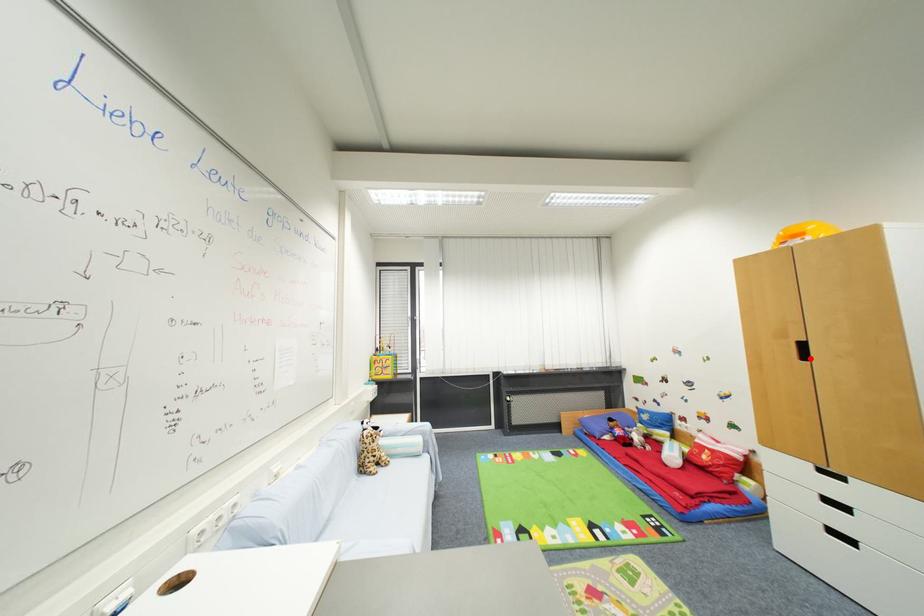
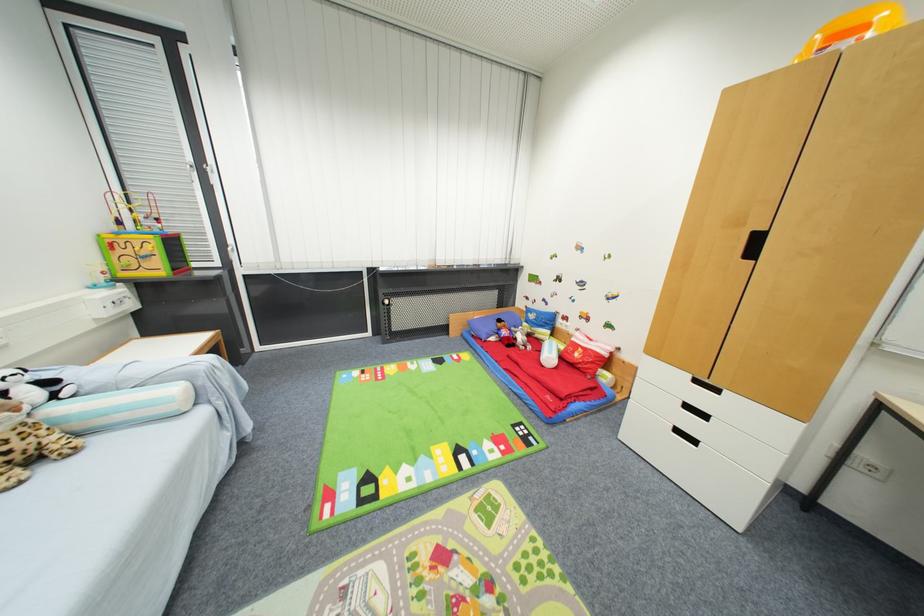
Find the pixel in the second image that matches the highlighted location in the first image.

(757, 254)